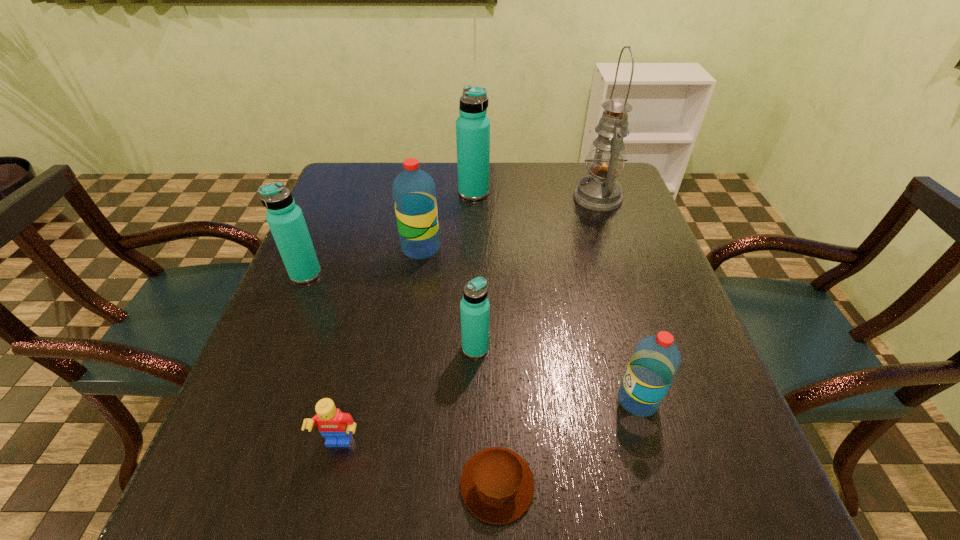
This screenshot has height=540, width=960. I want to click on the rightmost water bottle, so click(655, 361).

Where is `the nearer red water bottle`? The image size is (960, 540). the nearer red water bottle is located at coordinates (655, 361).

At what (x,y) coordinates should I click in order to perform the action: click on yellow Lego. Please return your answer as a coordinate pair (x, y). The height and width of the screenshot is (540, 960). Looking at the image, I should click on (335, 426).

Identify the location of Lego. (335, 426).

Image resolution: width=960 pixels, height=540 pixels. What are the coordinates of `muffin` in the screenshot? It's located at (497, 485).

Image resolution: width=960 pixels, height=540 pixels. What are the coordinates of `the shortest object` in the screenshot? It's located at (497, 485).

Image resolution: width=960 pixels, height=540 pixels. Find the location of `free space located 0.140m on the left of the gray oil lamp`. free space located 0.140m on the left of the gray oil lamp is located at coordinates (524, 198).

Identify the location of free space located on the front of the biggest blue water bottle. The width and height of the screenshot is (960, 540). (472, 296).

Where is `vacant region located 0.210m on the back of the fifth nearest object`? Image resolution: width=960 pixels, height=540 pixels. vacant region located 0.210m on the back of the fifth nearest object is located at coordinates (331, 212).

Locate an element on the screen. The image size is (960, 540). free spot located on the front label of the farther red water bottle is located at coordinates (537, 248).